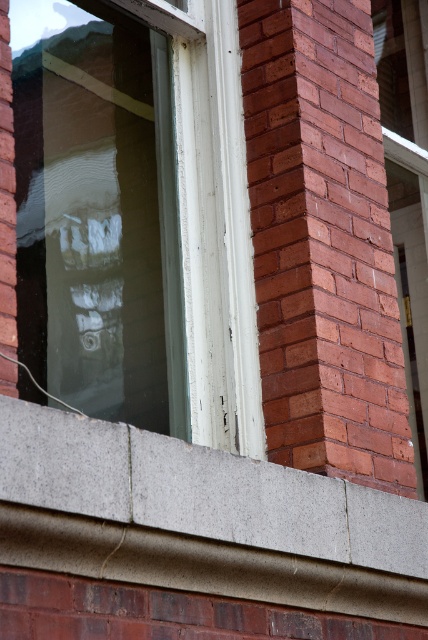
Question: Is white painted wood window at center above smooth concrete ledge at lower center?

Choices:
 (A) yes
 (B) no

Answer: (A)

Question: Considering the relative positions of white painted wood window at center and smooth concrete ledge at lower center in the image provided, where is white painted wood window at center located with respect to smooth concrete ledge at lower center?

Choices:
 (A) below
 (B) above

Answer: (B)

Question: Among these points, which one is farthest from the camera?

Choices:
 (A) click(192, 544)
 (B) click(133, 376)

Answer: (B)

Question: Observing the image, what is the correct spatial positioning of white painted wood window at center in reference to smooth concrete ledge at lower center?

Choices:
 (A) below
 (B) above

Answer: (B)

Question: Which point appears farthest from the camera in this image?

Choices:
 (A) coord(216,525)
 (B) coord(174,74)

Answer: (B)

Question: Which of the following is the closest to the observer?

Choices:
 (A) (235, 420)
 (B) (403, 532)

Answer: (A)